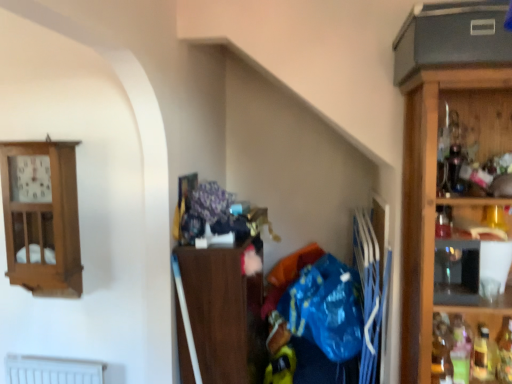
Question: From a real-world perspective, is translucent glass bottle at right, the fourth bottle when ordered from right to left, physically located above or below wooden clock at upper left, the 1th cabinetry from the left?

Choices:
 (A) above
 (B) below

Answer: (B)

Question: Is point (435, 322) positioned closer to the camera than point (40, 258)?

Choices:
 (A) farther
 (B) closer

Answer: (B)

Question: Which of these objects is positioned closest to the translucent glass bottle at lower right, arranged as the third bottle when viewed from the left?

Choices:
 (A) wooden clock at upper left, the 1th cabinetry from the left
 (B) blue plastic bag at center
 (C) brown wood cabinet at center, the 1th cabinetry from the right
 (D) translucent glass bottle at lower right, marked as the third bottle in a right-to-left arrangement
 (E) translucent glass bottle at right, the fourth bottle when ordered from right to left

Answer: (D)

Question: Which object is the closest to the translucent glass bottle at lower right, arranged as the third bottle when viewed from the left?

Choices:
 (A) blue plastic bag at center
 (B) wooden clock at upper left, acting as the 2th cabinetry starting from the right
 (C) translucent glass bottle at right, the first bottle viewed from the left
 (D) translucent glass bottle at lower right, placed as the second bottle when sorted from left to right
 (E) brown wood cabinet at center, the 1th cabinetry from the right

Answer: (D)